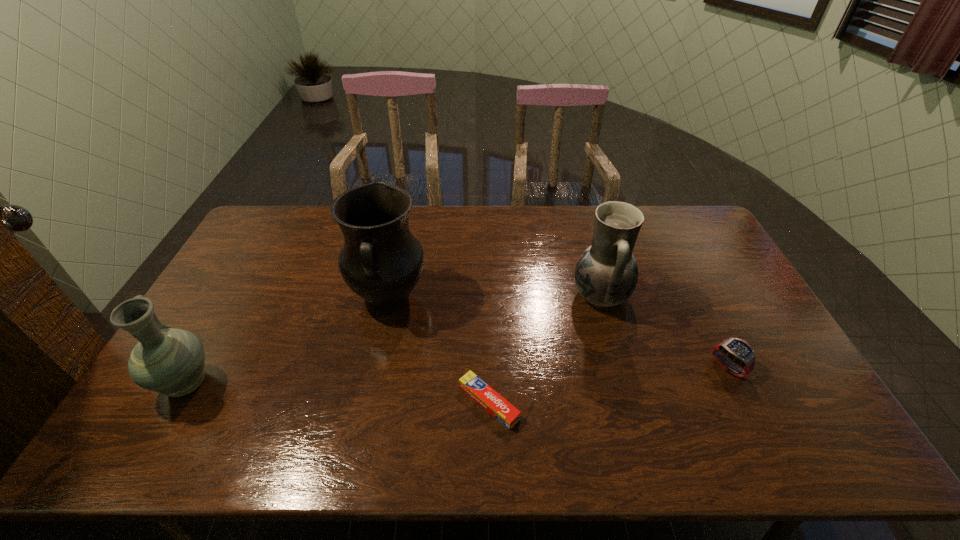
Where is `vacant space at the far edge of the desktop`? The height and width of the screenshot is (540, 960). vacant space at the far edge of the desktop is located at coordinates (529, 241).

In the image, there is a desktop. Identify the location of blank space at the near edge. The image size is (960, 540). (268, 431).

The height and width of the screenshot is (540, 960). What are the coordinates of `free location at the left edge` in the screenshot? It's located at (264, 248).

At what (x,y) coordinates should I click in order to perform the action: click on blank space at the far left corner. Please return your answer as a coordinate pair (x, y). The width and height of the screenshot is (960, 540). Looking at the image, I should click on (282, 235).

This screenshot has height=540, width=960. Find the location of `free space at the far right corner of the desktop`. free space at the far right corner of the desktop is located at coordinates (672, 220).

I want to click on vacant space at the near right corner, so click(770, 443).

In order to click on empty location between the second shortest object and the second pitcher from right to left in this screenshot , I will do `click(558, 332)`.

I want to click on vacant area that lies between the nearest pitcher and the rightmost object, so point(457,375).

This screenshot has width=960, height=540. In order to click on unoccupied area between the second object from left to right and the rightmost pitcher in this screenshot , I will do `click(494, 296)`.

Locate an element on the screen. vacant region between the toothpaste and the leftmost pitcher is located at coordinates (338, 393).